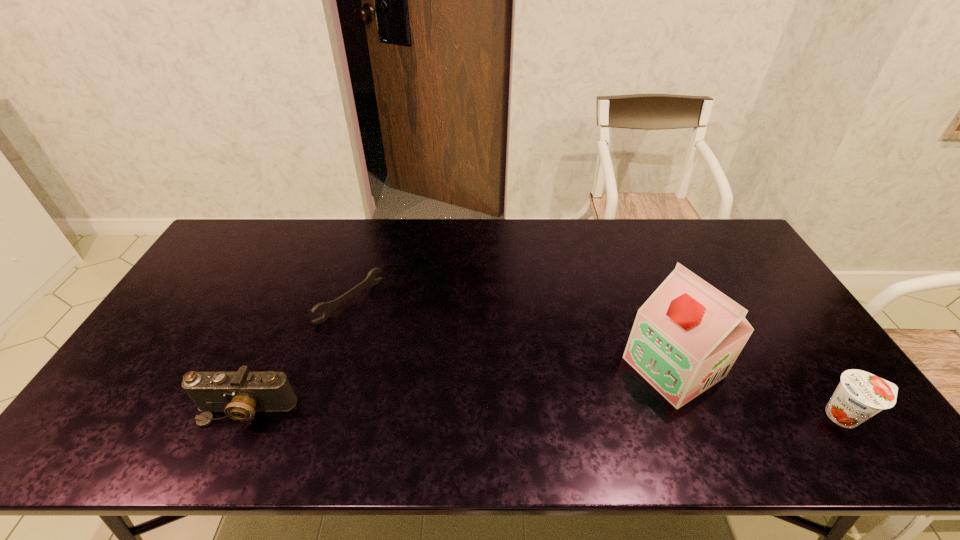
At what (x,y) coordinates should I click in order to perform the action: click on blank region between the second object from right to left and the yogurt. Please return your answer as a coordinate pair (x, y). The height and width of the screenshot is (540, 960). Looking at the image, I should click on (759, 391).

You are a GUI agent. You are given a task and a screenshot of the screen. Output one action in this format:
    pyautogui.click(x=<x>, y=<y>)
    Task: Click on the vacant area between the yogurt and the soya milk
    This screenshot has height=540, width=960.
    Given the screenshot: What is the action you would take?
    pyautogui.click(x=759, y=391)

The width and height of the screenshot is (960, 540). What are the coordinates of `free point between the camera and the shortest object` in the screenshot? It's located at (299, 356).

Identify the location of vacant space that is in between the camera and the yogurt. The width and height of the screenshot is (960, 540). (545, 413).

You are a GUI agent. You are given a task and a screenshot of the screen. Output one action in this format:
    pyautogui.click(x=<x>, y=<y>)
    Task: Click on the free space between the tallest object and the camera
    This screenshot has width=960, height=540.
    Given the screenshot: What is the action you would take?
    pyautogui.click(x=460, y=389)

The image size is (960, 540). Find the location of `vacant space that's between the camera and the wrench`. vacant space that's between the camera and the wrench is located at coordinates (299, 356).

Where is `unoccupied position between the wrench and the camera`? unoccupied position between the wrench and the camera is located at coordinates 299,356.

You are a GUI agent. You are given a task and a screenshot of the screen. Output one action in this format:
    pyautogui.click(x=<x>, y=<y>)
    Task: Click on the vacant space that's between the rightmost object and the soya milk
    
    Given the screenshot: What is the action you would take?
    pyautogui.click(x=759, y=391)

Where is `free space between the tallest object and the rightmost object`? free space between the tallest object and the rightmost object is located at coordinates (759, 391).

Locate an element on the screen. This screenshot has width=960, height=540. the third closest object to the second object from right to left is located at coordinates (240, 394).